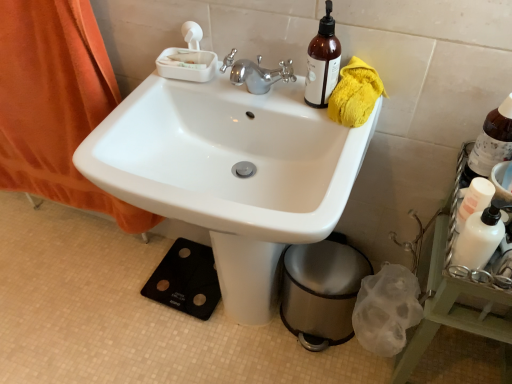
Identify the location of vacant space to the left of metallic trash can at lower right. (249, 346).